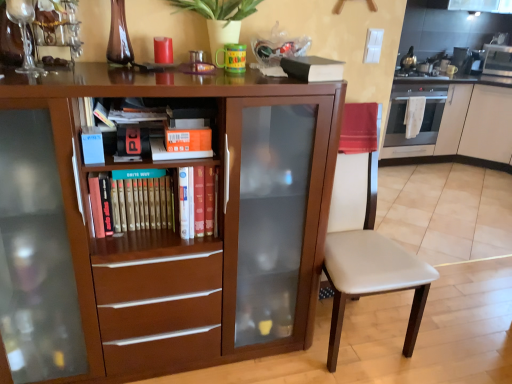
The height and width of the screenshot is (384, 512). Describe the element at coordinates (198, 201) in the screenshot. I see `hardcover book at center` at that location.

Image resolution: width=512 pixels, height=384 pixels. Describe the element at coordinates (188, 139) in the screenshot. I see `orange matte bookshelf at center, the 2th paperback book from the top` at that location.

What do you see at coordinates (313, 68) in the screenshot? I see `black matte book at upper center, which ranks as the 4th paperback book in left-to-right order` at bounding box center [313, 68].

Locate an element on the screen. hardcover book at left, the 1th paperback book when ordered from left to right is located at coordinates (106, 203).

Describe the element at coordinates (174, 152) in the screenshot. Image resolution: width=512 pixels, height=384 pixels. I see `orange matte paperback book at center, which is the third paperback book from top to bottom` at that location.

What is the approximate width of white leather chair at center?

It is 26.25 inches.

Identify the location of hardcover book at center. This screenshot has width=512, height=384. (198, 201).

Can you confirm if white glossy cabinet at right, the 1th cabinetry in the back-to-front sequence, is shorter than hardcover book at center?

No, white glossy cabinet at right, the 1th cabinetry in the back-to-front sequence, is not shorter than hardcover book at center.

Based on their sizes in the image, would you say white glossy cabinet at right, the 1th cabinetry in the back-to-front sequence, is bigger or smaller than hardcover book at center?

In the image, white glossy cabinet at right, the 1th cabinetry in the back-to-front sequence, appears to be larger than hardcover book at center.

In the image, there is a hardcover book at center. Identify the location of cabinetry above it (from the image's perspective). Image resolution: width=512 pixels, height=384 pixels. (453, 121).

Is hardcover book at left, the 1th paperback book when ordered from left to right, in front of or behind brown matte cabinet at center, placed as the 2th cabinetry when sorted from back to front, in the image?

In the image, hardcover book at left, the 1th paperback book when ordered from left to right, appears behind brown matte cabinet at center, placed as the 2th cabinetry when sorted from back to front.

Does point (100, 195) lie behind point (250, 84)?

Yes, it is behind point (250, 84).

Is hardcover book at left, positioned as the 1th paperback book in bottom-to-top order, oriented away from brown matte cabinet at center, placed as the second cabinetry when sorted from right to left?

Yes, hardcover book at left, positioned as the 1th paperback book in bottom-to-top order, is facing away from brown matte cabinet at center, placed as the second cabinetry when sorted from right to left.

From a real-world perspective, does hardcover book at left, arranged as the 4th paperback book when viewed from the right, sit lower than brown matte cabinet at center, which appears as the first cabinetry when viewed from the front?

No, from a real-world perspective, hardcover book at left, arranged as the 4th paperback book when viewed from the right, is not beneath brown matte cabinet at center, which appears as the first cabinetry when viewed from the front.

Considering the sizes of orange matte paperback book at center, placed as the 3th paperback book when sorted from right to left, and satin silver oven at right in the image, is orange matte paperback book at center, placed as the 3th paperback book when sorted from right to left, taller or shorter than satin silver oven at right?

Clearly, orange matte paperback book at center, placed as the 3th paperback book when sorted from right to left, is shorter compared to satin silver oven at right.

How many degrees apart are the facing directions of orange matte paperback book at center, which ranks as the second paperback book in left-to-right order, and satin silver oven at right?

The facing directions of orange matte paperback book at center, which ranks as the second paperback book in left-to-right order, and satin silver oven at right are 1.07 degrees apart.

From a real-world perspective, who is located higher, orange matte paperback book at center, which appears as the second paperback book when ordered from the bottom, or satin silver oven at right?

From a 3D spatial view, orange matte paperback book at center, which appears as the second paperback book when ordered from the bottom, is above.

Is orange matte paperback book at center, which is the third paperback book from top to bottom, not near satin silver oven at right?

orange matte paperback book at center, which is the third paperback book from top to bottom, is far away from satin silver oven at right.

Visually, is hardcover book at center positioned to the left or to the right of brown matte cabinet at center, placed as the 1th cabinetry when sorted from left to right?

Based on their positions, hardcover book at center is located to the right of brown matte cabinet at center, placed as the 1th cabinetry when sorted from left to right.

Is the surface of hardcover book at center in direct contact with brown matte cabinet at center, which appears as the first cabinetry when viewed from the front?

No, hardcover book at center is not touching brown matte cabinet at center, which appears as the first cabinetry when viewed from the front.

Can you confirm if hardcover book at center is smaller than brown matte cabinet at center, placed as the 2th cabinetry when sorted from back to front?

Indeed, hardcover book at center has a smaller size compared to brown matte cabinet at center, placed as the 2th cabinetry when sorted from back to front.

Consider the image. From a real-world perspective, is satin silver oven at right above or below brown matte cabinet at center, placed as the 2th cabinetry when sorted from back to front?

satin silver oven at right is situated lower than brown matte cabinet at center, placed as the 2th cabinetry when sorted from back to front, in the real world.

Would you say satin silver oven at right is inside or outside brown matte cabinet at center, placed as the 1th cabinetry when sorted from left to right?

satin silver oven at right is not enclosed by brown matte cabinet at center, placed as the 1th cabinetry when sorted from left to right.

How much distance is there between satin silver oven at right and brown matte cabinet at center, which appears as the first cabinetry when viewed from the front?

They are 2.89 meters apart.

Would you consider satin silver oven at right to be distant from brown matte cabinet at center, placed as the second cabinetry when sorted from right to left?

Yes, satin silver oven at right is far from brown matte cabinet at center, placed as the second cabinetry when sorted from right to left.

Considering the sizes of objects white leather chair at center and brown matte cabinet at center, placed as the second cabinetry when sorted from right to left, in the image provided, who is bigger, white leather chair at center or brown matte cabinet at center, placed as the second cabinetry when sorted from right to left,?

With larger size is brown matte cabinet at center, placed as the second cabinetry when sorted from right to left.

Considering the relative positions of white leather chair at center and brown matte cabinet at center, placed as the 1th cabinetry when sorted from left to right, in the image provided, is white leather chair at center to the left or to the right of brown matte cabinet at center, placed as the 1th cabinetry when sorted from left to right,?

From the image, it's evident that white leather chair at center is to the right of brown matte cabinet at center, placed as the 1th cabinetry when sorted from left to right.

How many degrees apart are the facing directions of white leather chair at center and brown matte cabinet at center, placed as the 2th cabinetry when sorted from back to front?

The angular difference between white leather chair at center and brown matte cabinet at center, placed as the 2th cabinetry when sorted from back to front, is 4.69e-05 degrees.

Is white leather chair at center positioned with its back to brown matte cabinet at center, which appears as the first cabinetry when viewed from the front?

No, brown matte cabinet at center, which appears as the first cabinetry when viewed from the front, is not at the back of white leather chair at center.

Does black matte book at upper center, positioned as the 4th paperback book in bottom-to-top order, touch hardcover book at center?

No.

Find the location of a particular element. The image size is (512, 384). book lying below the black matte book at upper center, positioned as the 4th paperback book in bottom-to-top order (from the image's perspective) is located at coordinates (198, 201).

Does black matte book at upper center, marked as the 1th paperback book in a top-to-bottom arrangement, have a larger size compared to hardcover book at center?

No.

Is black matte book at upper center, marked as the 1th paperback book in a top-to-bottom arrangement, positioned with its back to hardcover book at center?

No, black matte book at upper center, marked as the 1th paperback book in a top-to-bottom arrangement,'s orientation is not away from hardcover book at center.

This screenshot has height=384, width=512. I want to click on the 2nd cabinetry directly beneath the hardcover book at center (from a real-world perspective), so click(x=453, y=121).

From the hardcover book at left, arranged as the 4th paperback book when viewed from the right, count 1st cabinetry to the right and point to it. Please provide its 2D coordinates.

[(161, 228)]

Considering their positions, is orange matte bookshelf at center, acting as the second paperback book starting from the right, positioned further to white glossy cabinet at right, arranged as the 2th cabinetry when viewed from the left, than metallic stainless steel microwave at upper right?

orange matte bookshelf at center, acting as the second paperback book starting from the right.

In the scene shown: Looking at the image, which one is located further to green matte plant at upper center, hardcover book at center or brown matte cabinet at center, placed as the 2th cabinetry when sorted from back to front?

The object further to green matte plant at upper center is brown matte cabinet at center, placed as the 2th cabinetry when sorted from back to front.

From the image, which object appears to be farther from white leather chair at center, hardcover book at center or green matte plant at upper center?

Among the two, green matte plant at upper center is located further to white leather chair at center.

Estimate the real-world distances between objects in this image. Which object is closer to orange matte bookshelf at center, the 2th paperback book from the top, white leather chair at center or hardcover book at left, arranged as the 4th paperback book when viewed from the right?

hardcover book at left, arranged as the 4th paperback book when viewed from the right.

Looking at the image, which one is located further to satin silver oven at right, orange matte paperback book at center, which is the third paperback book from top to bottom, or black matte book at upper center, marked as the 1th paperback book in a top-to-bottom arrangement?

Based on the image, orange matte paperback book at center, which is the third paperback book from top to bottom, appears to be further to satin silver oven at right.

Looking at the image, which one is located further to white leather chair at center, orange matte paperback book at center, which is the third paperback book from top to bottom, or black matte book at upper center, placed as the 1th paperback book when sorted from right to left?

orange matte paperback book at center, which is the third paperback book from top to bottom, is further to white leather chair at center.

When comparing their distances from orange matte bookshelf at center, positioned as the third paperback book in bottom-to-top order, does satin silver oven at right or white leather chair at center seem closer?

white leather chair at center lies closer to orange matte bookshelf at center, positioned as the third paperback book in bottom-to-top order, than the other object.

Considering their positions, is orange matte paperback book at center, placed as the 3th paperback book when sorted from right to left, positioned further to hardcover book at left, arranged as the 4th paperback book when viewed from the right, than orange matte bookshelf at center, which is counted as the 3th paperback book, starting from the left?

The object further to hardcover book at left, arranged as the 4th paperback book when viewed from the right, is orange matte bookshelf at center, which is counted as the 3th paperback book, starting from the left.

Image resolution: width=512 pixels, height=384 pixels. I want to click on plant positioned between brown matte cabinet at center, placed as the second cabinetry when sorted from right to left, and satin silver oven at right from near to far, so (219, 18).

This screenshot has height=384, width=512. I want to click on plant between hardcover book at left, positioned as the 1th paperback book in bottom-to-top order, and black matte book at upper center, which ranks as the 4th paperback book in left-to-right order, from left to right, so click(219, 18).

You are a GUI agent. You are given a task and a screenshot of the screen. Output one action in this format:
    pyautogui.click(x=<x>, y=<y>)
    Task: Click on the plant between orange matte paperback book at center, placed as the 3th paperback book when sorted from right to left, and metallic stainless steel microwave at upper right, in the horizontal direction
    Image resolution: width=512 pixels, height=384 pixels.
    Given the screenshot: What is the action you would take?
    pyautogui.click(x=219, y=18)

At what (x,y) coordinates should I click in order to perform the action: click on plant between white leather chair at center and metallic stainless steel microwave at upper right from front to back. Please return your answer as a coordinate pair (x, y). This screenshot has width=512, height=384. Looking at the image, I should click on (219, 18).